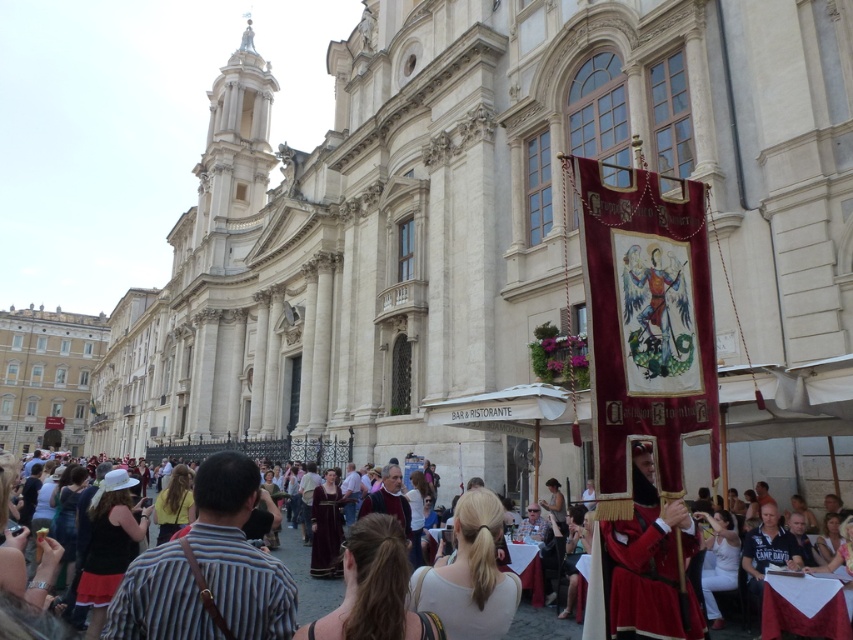
You are standing in front of the grand building and want to take a photo of both the white matte shirt at center and the dark brown leather dress at center. Which one should you focus on first to ensure both are in clear view?

You should focus on the white matte shirt at center first since it is closer to you than the dark brown leather dress at center, ensuring both will be in clear view when focused on the closer object.

You are standing in front of the grand building and notice two people in the crowd. One is wearing a matte black shirt at lower left and the other is in a silk red dress at center. Which person is closer to you?

The matte black shirt at lower left is positioned over the silk red dress at center, so the person in the matte black shirt at lower left is closer to you.

You are standing in front of the grand building and want to take a photo of the point at coordinates (456, 529). If your camera has a maximum focus range of 40 meters, will you be able to focus on that point?

The point at coordinates (456, 529) is 40.95 meters away from the viewer. Since the camera can only focus up to 40 meters, it won not be able to focus on that point.